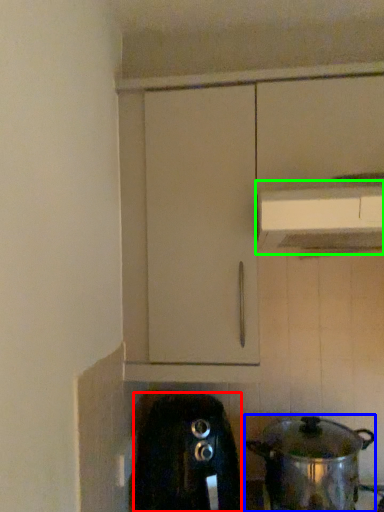
Question: Which object is positioned closest to home appliance (highlighted by a red box)? Select from kitchen appliance (highlighted by a blue box) and vent (highlighted by a green box).

Choices:
 (A) kitchen appliance
 (B) vent

Answer: (A)